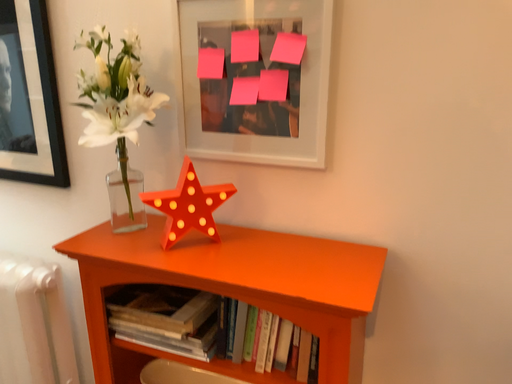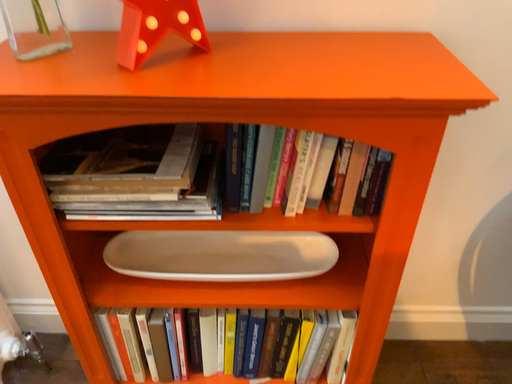
Question: Which way did the camera rotate in the video?

Choices:
 (A) rotated right
 (B) rotated left

Answer: (A)